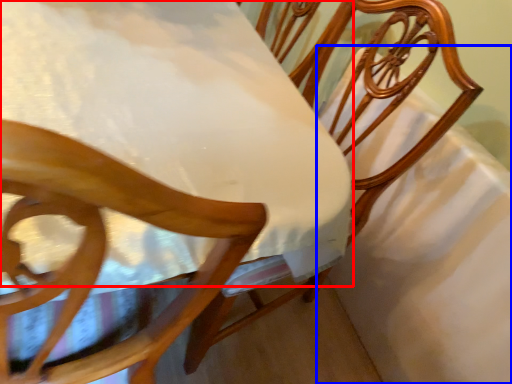
Question: Which object is further to the camera taking this photo, table (highlighted by a red box) or sheet (highlighted by a blue box)?

Choices:
 (A) table
 (B) sheet

Answer: (B)